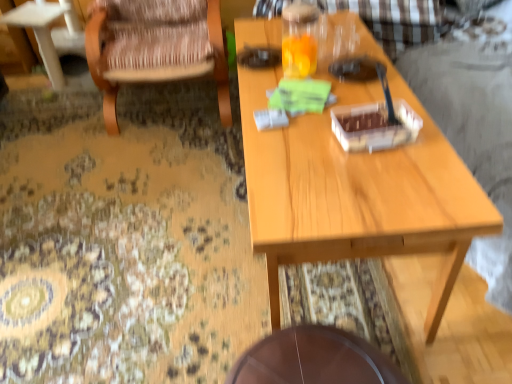
Question: Looking at their shapes, would you say wooden coffee table at left is wider or thinner than wooden woven chair at left?

Choices:
 (A) wide
 (B) thin

Answer: (B)

Question: From a real-world perspective, relative to wooden woven chair at left, is wooden coffee table at left vertically above or below?

Choices:
 (A) above
 (B) below

Answer: (B)

Question: Estimate the real-world distances between objects in this image. Which object is farther from the light wood table at center?

Choices:
 (A) wooden woven chair at left
 (B) wooden coffee table at left
 (C) brown wooden table at lower center

Answer: (B)

Question: Which object is the farthest from the brown wooden table at lower center?

Choices:
 (A) light wood table at center
 (B) wooden woven chair at left
 (C) wooden coffee table at left

Answer: (C)